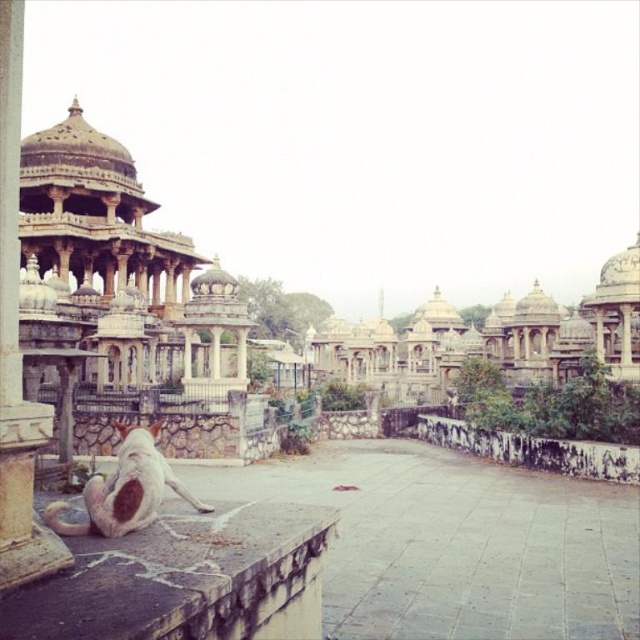
Does white stone palace at left lie behind white stone palaces at center?

No, it is not.

Who is lower down, white stone palace at left or white stone palaces at center?

white stone palaces at center is lower down.

Find the location of `white stone palace at left`. white stone palace at left is located at coordinates click(124, 273).

In the scene shown: Which is more to the right, gray stone ledge at lower left or polished stone pillar at left?

Positioned to the right is gray stone ledge at lower left.

Is gray stone ledge at lower left positioned before polished stone pillar at left?

Yes, gray stone ledge at lower left is closer to the viewer.

Who is more forward, (12,609) or (1,104)?

Point (12,609) is more forward.

The height and width of the screenshot is (640, 640). What are the coordinates of `gray stone ledge at lower left` in the screenshot? It's located at (182, 577).

From the picture: Who is more distant from viewer, (193, 369) or (188, 560)?

The point (193, 369) is behind.

Can you confirm if white stone palace at left is thinner than gray stone ledge at lower left?

Incorrect, white stone palace at left's width is not less than gray stone ledge at lower left's.

Who is more forward, [208,355] or [61,636]?

Point [61,636] is in front.

Locate an element on the screen. The height and width of the screenshot is (640, 640). white stone palace at left is located at coordinates (124, 273).